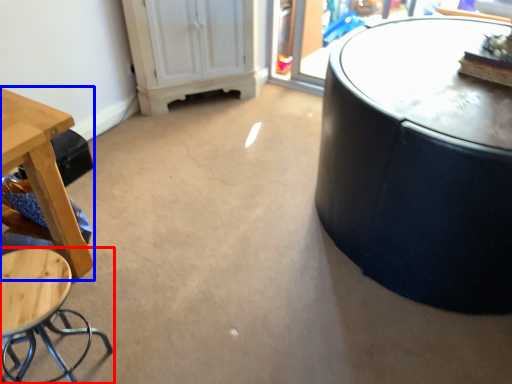
Question: Which point is closer to the camera, stool (highlighted by a red box) or table (highlighted by a blue box)?

Choices:
 (A) stool
 (B) table

Answer: (A)